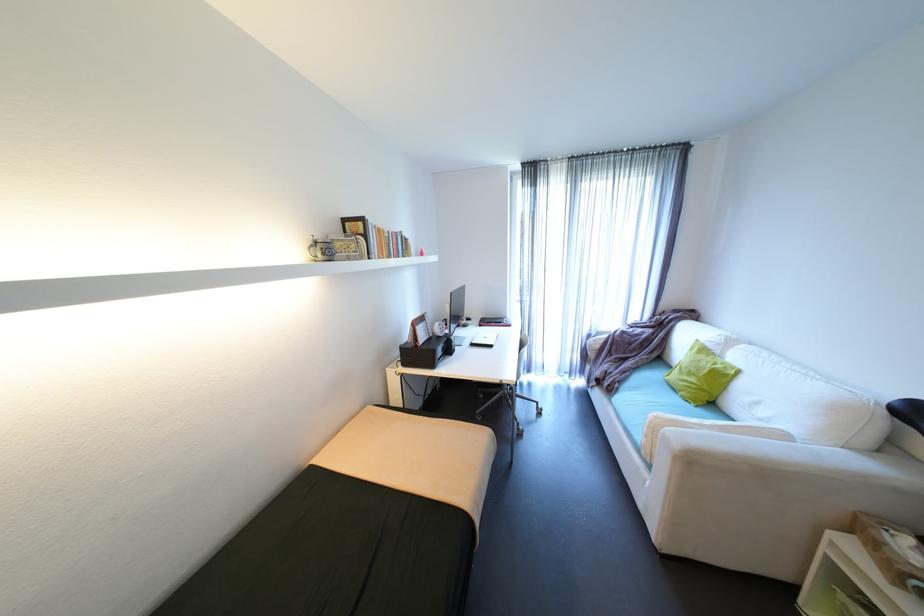
What do you see at coordinates (655, 397) in the screenshot?
I see `a sofa sitting surface` at bounding box center [655, 397].